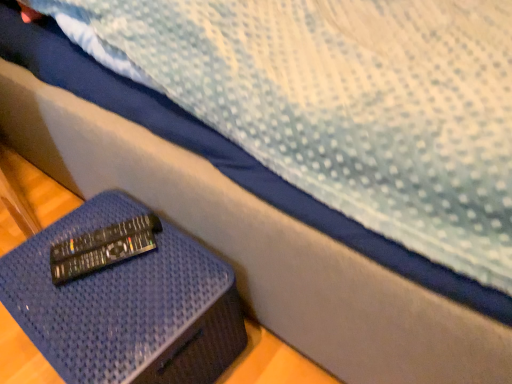
Question: Is black plastic remote at lower left, which is the first remote from front to back, taller or shorter than black plastic remote at lower left, acting as the 1th remote starting from the back?

Choices:
 (A) tall
 (B) short

Answer: (A)

Question: From the image's perspective, is black plastic remote at lower left, which is the first remote from front to back, located above or below black plastic remote at lower left, acting as the 2th remote starting from the front?

Choices:
 (A) above
 (B) below

Answer: (B)

Question: Which is nearer to the blue textured ottoman at lower left?

Choices:
 (A) black plastic remote at lower left, acting as the 2th remote starting from the front
 (B) black plastic remote at lower left, which is the first remote from front to back

Answer: (B)

Question: Estimate the real-world distances between objects in this image. Which object is farther from the black plastic remote at lower left, the second remote viewed from the back?

Choices:
 (A) black plastic remote at lower left, acting as the 1th remote starting from the back
 (B) blue textured ottoman at lower left

Answer: (B)